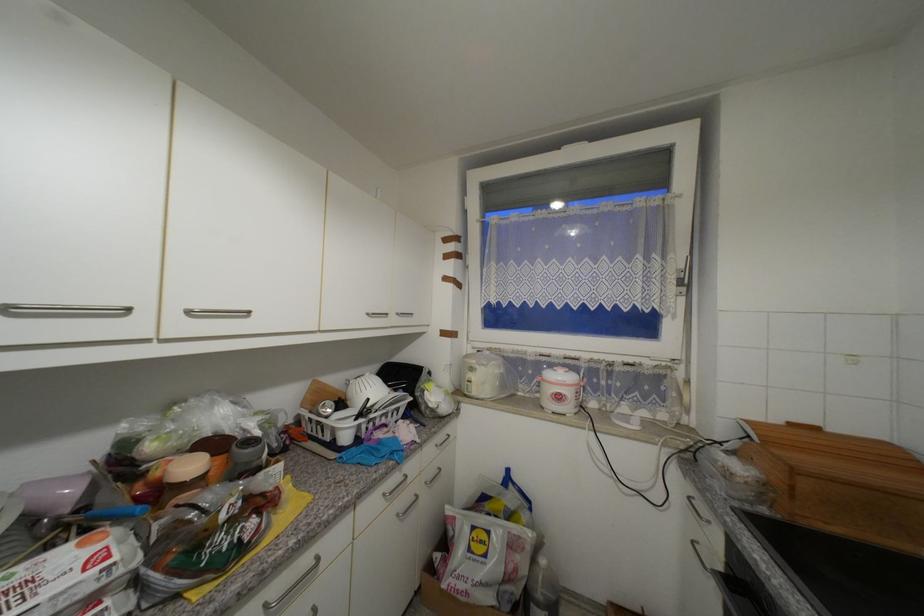
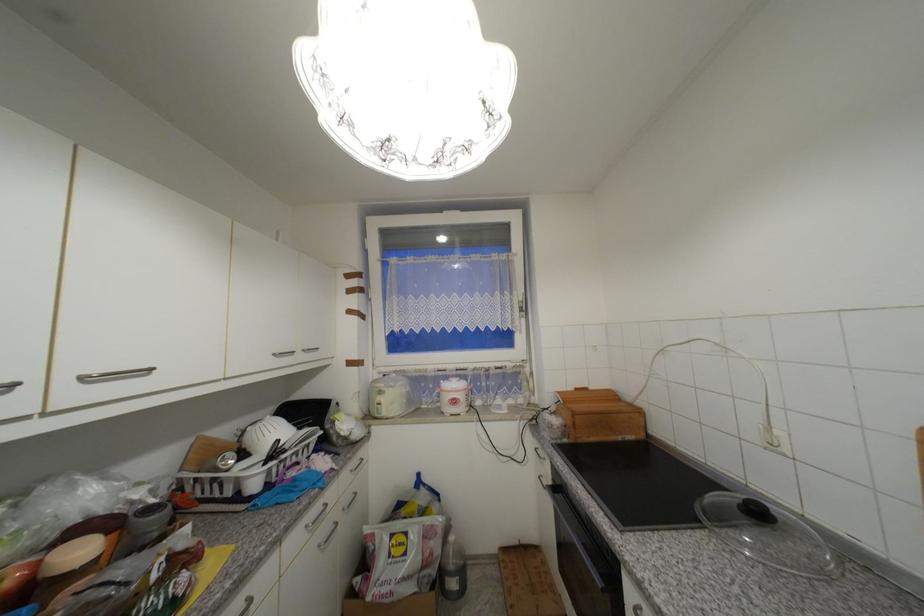
Where in the second image is the point corresponding to (783,422) from the first image?

(576, 390)